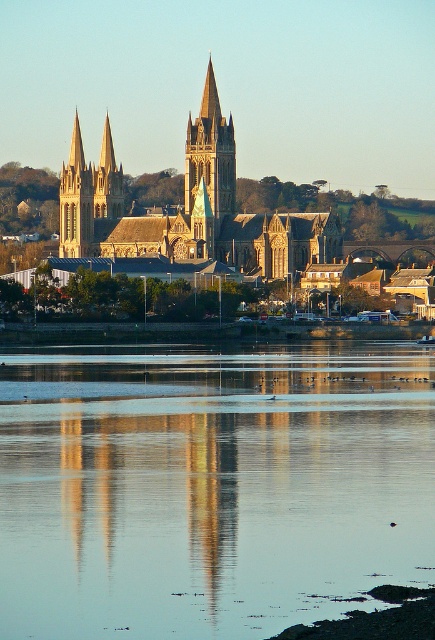
Question: Does silvery reflective water at center appear over golden stone tower at center?

Choices:
 (A) no
 (B) yes

Answer: (A)

Question: Which is nearer to the silvery reflective water at center?

Choices:
 (A) golden stone church at center
 (B) golden stone tower at center

Answer: (A)

Question: Which of the following is the farthest from the observer?

Choices:
 (A) (216, 124)
 (B) (201, 108)
 (C) (370, 513)

Answer: (B)

Question: Estimate the real-world distances between objects in this image. Which object is farther from the golden stone tower at center?

Choices:
 (A) golden stone church at center
 (B) silvery reflective water at center

Answer: (B)

Question: Is silvery reflective water at center positioned behind golden stone tower at center?

Choices:
 (A) no
 (B) yes

Answer: (A)

Question: Can you confirm if golden stone church at center is smaller than golden stone tower at center?

Choices:
 (A) yes
 (B) no

Answer: (B)